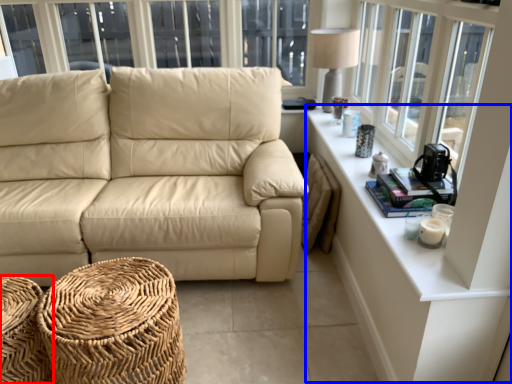
Question: Which object appears closest to the camera in this image, footrest (highlighted by a red box) or table (highlighted by a blue box)?

Choices:
 (A) footrest
 (B) table

Answer: (B)